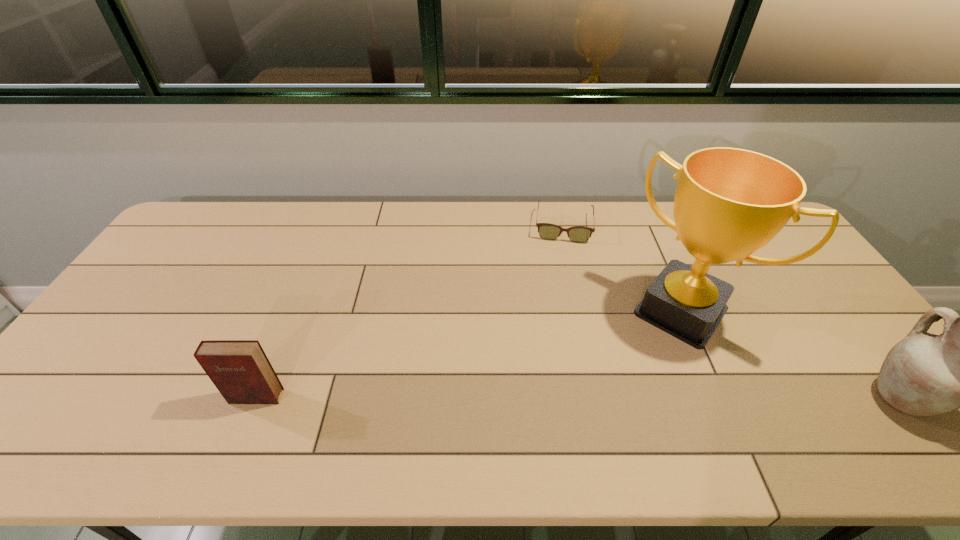
What are the coordinates of `diary` in the screenshot? It's located at (240, 370).

The height and width of the screenshot is (540, 960). I want to click on the third tallest object, so click(x=240, y=370).

The height and width of the screenshot is (540, 960). Identify the location of the second farthest object. (729, 202).

Where is `the second object from right to left`? the second object from right to left is located at coordinates (729, 202).

Locate an element on the screen. This screenshot has width=960, height=540. the farthest object is located at coordinates (579, 234).

Where is `the third object from right to left`? The height and width of the screenshot is (540, 960). the third object from right to left is located at coordinates (579, 234).

Image resolution: width=960 pixels, height=540 pixels. In order to click on free spot located 0.110m on the front-facing side of the second object from right to left in this screenshot , I will do `click(636, 367)`.

Locate an element on the screen. This screenshot has width=960, height=540. free space located 0.240m on the front-facing side of the second object from right to left is located at coordinates (x=611, y=401).

The image size is (960, 540). Find the location of `vacant space located on the front-facing side of the second object from right to left`. vacant space located on the front-facing side of the second object from right to left is located at coordinates coord(644,355).

Locate an element on the screen. blank area located 0.050m at the front view of the farthest object is located at coordinates (562, 254).